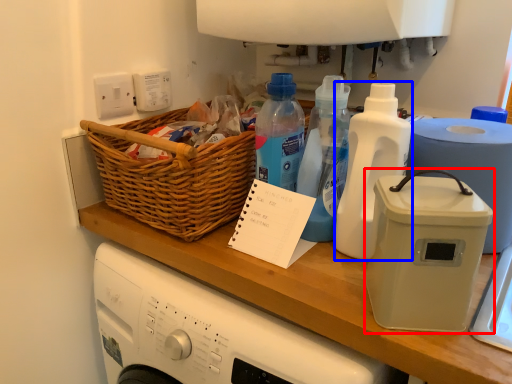
Question: Which object appears farthest to the camera in this image, kitchen appliance (highlighted by a red box) or bottle (highlighted by a blue box)?

Choices:
 (A) kitchen appliance
 (B) bottle

Answer: (B)